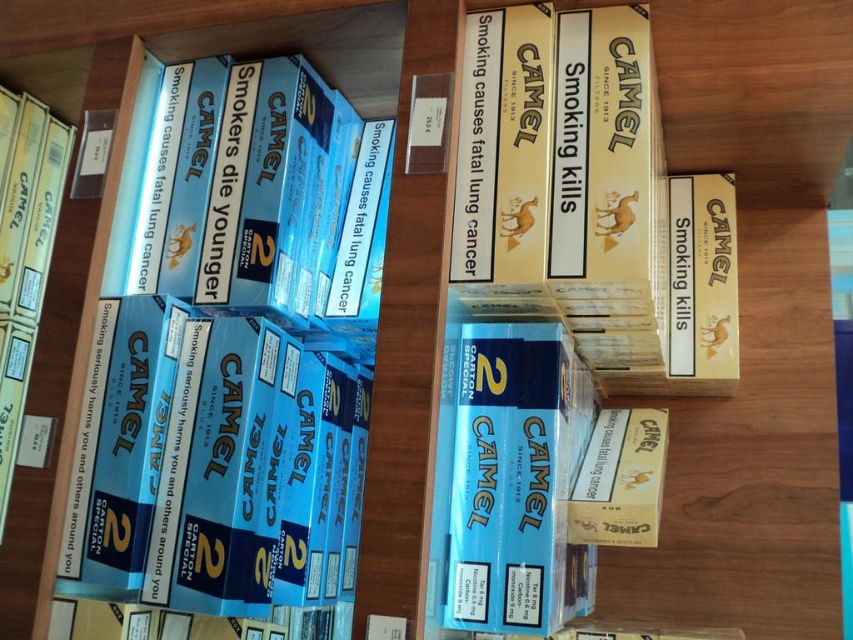
Question: Which of the following is the closest to the observer?

Choices:
 (A) matte yellow cardboard at center
 (B) blue cardboard pack at center
 (C) blue cardboard box at left

Answer: (B)

Question: Which object is positioned closest to the matte yellow cardboard at center?

Choices:
 (A) matte cardboard book at lower left
 (B) blue cardboard box at left
 (C) blue cardboard pack at center

Answer: (C)

Question: From the image, what is the correct spatial relationship of blue cardboard box at left in relation to blue cardboard pack at center?

Choices:
 (A) right
 (B) left

Answer: (B)

Question: From the image, what is the correct spatial relationship of blue cardboard box at left in relation to matte yellow cardboard at center?

Choices:
 (A) right
 (B) left

Answer: (B)

Question: Which is nearer to the matte cardboard book at lower left?

Choices:
 (A) blue cardboard pack at center
 (B) blue cardboard box at left

Answer: (B)

Question: Where is matte cardboard book at lower left located in relation to matte yellow cardboard at center in the image?

Choices:
 (A) left
 (B) right

Answer: (A)